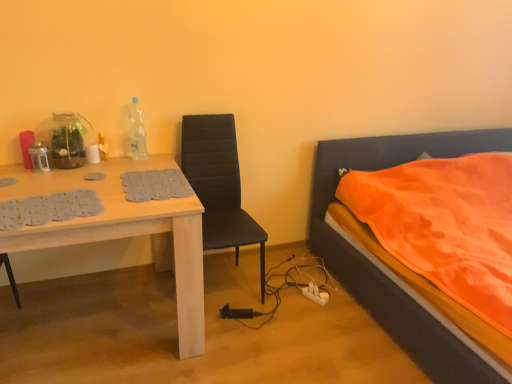
I want to click on vacant space behind white plastic power outlet at lower center, so click(x=314, y=284).